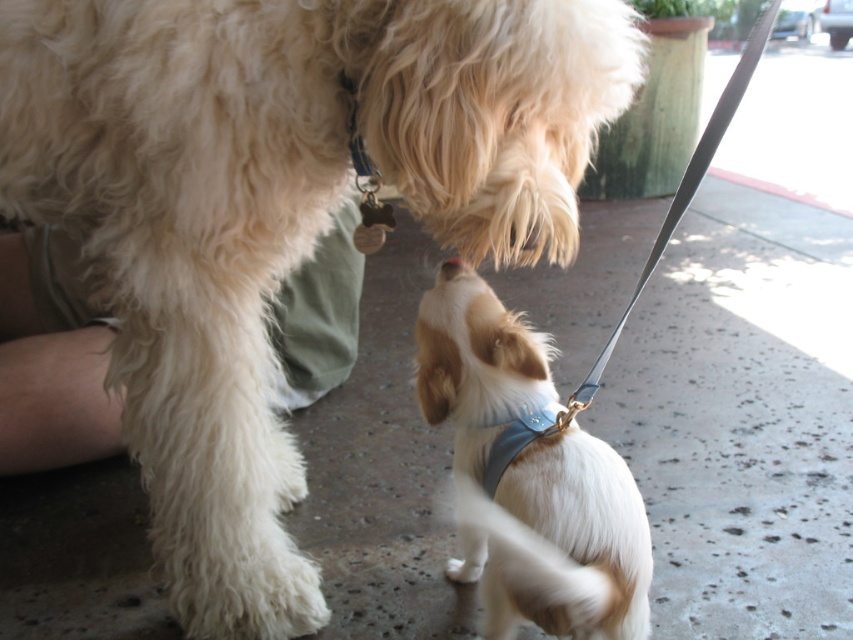
In the scene shown: How much distance is there between white soft fur dog at center and smooth gray leash at center?

white soft fur dog at center and smooth gray leash at center are 6.01 inches apart.

Image resolution: width=853 pixels, height=640 pixels. I want to click on white soft fur dog at center, so click(527, 476).

Can you confirm if smooth gray leash at center is positioned to the left of blue fabric neckband at lower center?

In fact, smooth gray leash at center is to the right of blue fabric neckband at lower center.

Can you confirm if smooth gray leash at center is wider than blue fabric neckband at lower center?

Correct, the width of smooth gray leash at center exceeds that of blue fabric neckband at lower center.

At what (x,y) coordinates should I click in order to perform the action: click on smooth gray leash at center. Please return your answer as a coordinate pair (x, y). Looking at the image, I should click on (640, 273).

At what (x,y) coordinates should I click in order to perform the action: click on smooth gray leash at center. Please return your answer as a coordinate pair (x, y). This screenshot has height=640, width=853. Looking at the image, I should click on (640, 273).

Who is shorter, white soft fur dog at center or blue fabric neckband at lower center?

With less height is blue fabric neckband at lower center.

The width and height of the screenshot is (853, 640). Find the location of `white soft fur dog at center`. white soft fur dog at center is located at coordinates (527, 476).